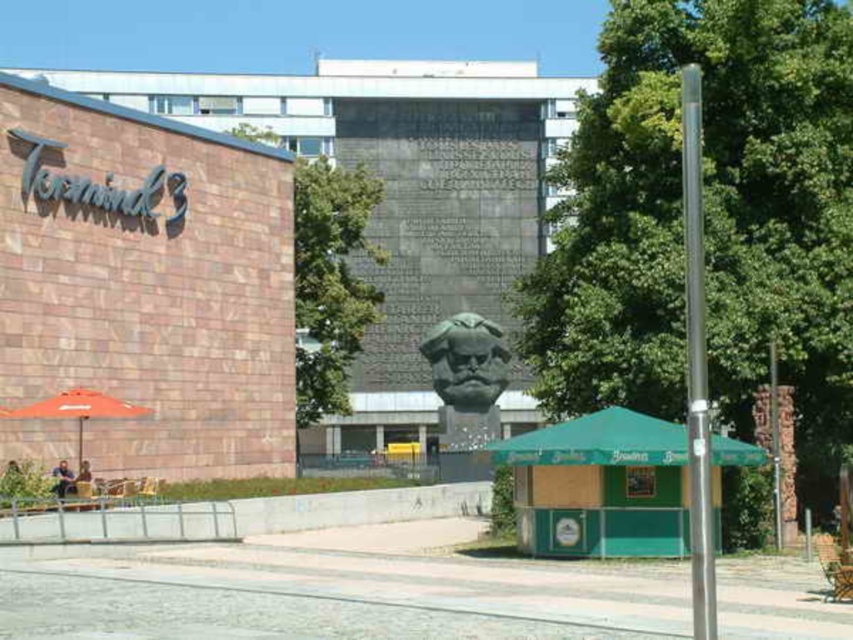
Question: Among these objects, which one is farthest from the camera?

Choices:
 (A) orange fabric umbrella at lower left
 (B) green polished stone bust at center
 (C) matte brick mall at left

Answer: (B)

Question: Which of the following is the farthest from the observer?

Choices:
 (A) green polished stone bust at center
 (B) matte brick mall at left

Answer: (A)

Question: Which of the following is the farthest from the observer?

Choices:
 (A) coord(453,118)
 (B) coord(55,408)
 (C) coord(466,381)

Answer: (A)

Question: Observing the image, what is the correct spatial positioning of green polished stone bust at center in reference to orange fabric umbrella at lower left?

Choices:
 (A) below
 (B) above

Answer: (B)

Question: In this image, where is green polished stone bust at center located relative to orange fabric umbrella at lower left?

Choices:
 (A) left
 (B) right

Answer: (B)

Question: Is green polished stone bust at center to the right of orange fabric umbrella at lower left from the viewer's perspective?

Choices:
 (A) yes
 (B) no

Answer: (A)